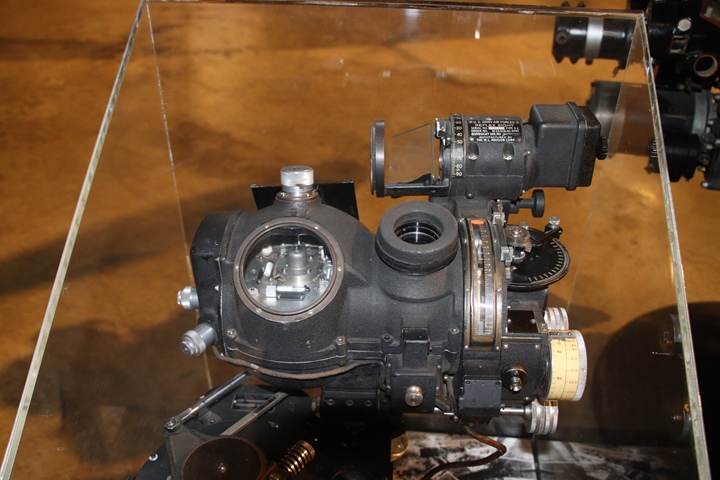
The width and height of the screenshot is (720, 480). In order to click on glass case wall in this screenshot , I will do `click(94, 290)`, `click(230, 127)`, `click(646, 266)`.